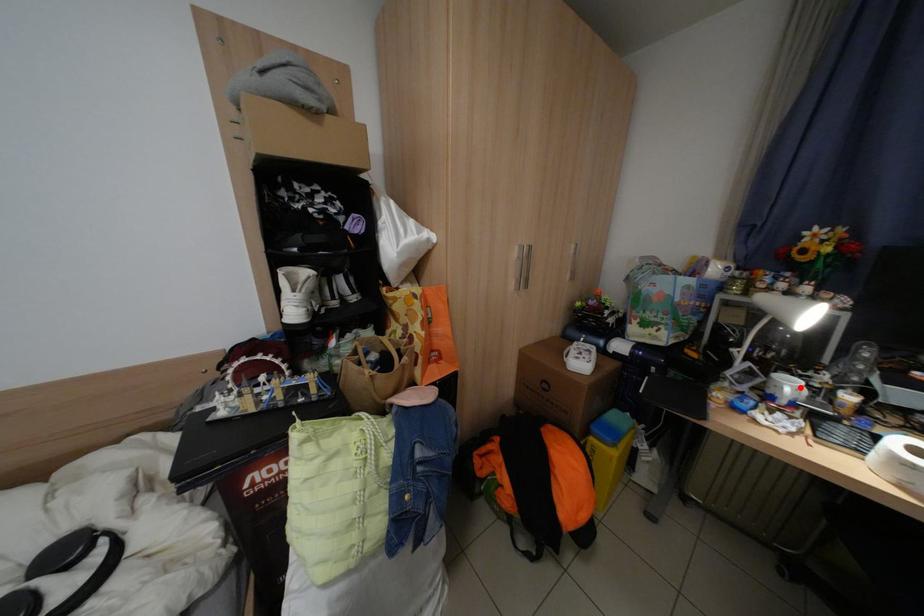
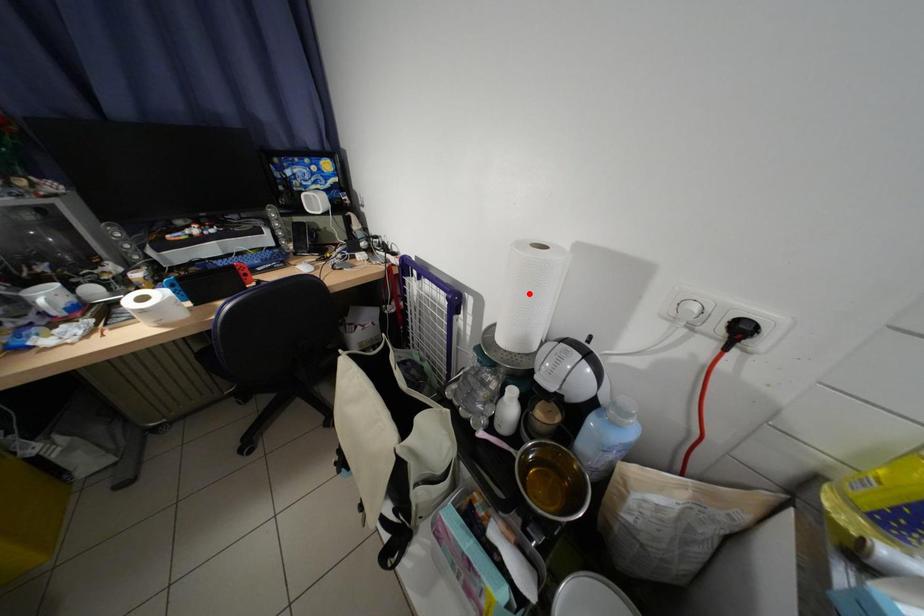
I am providing you with two images of the same scene from different viewpoints. A red point is marked on the first image and another point is marked on the second image. Do the highlighted points in image1 and image2 indicate the same real-world spot?

No